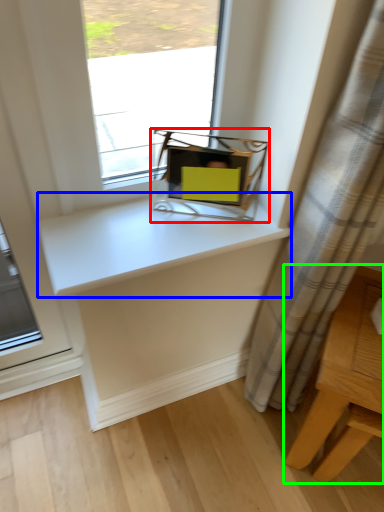
Question: Based on their relative distances, which object is nearer to equipment (highlighted by a red box)? Choose from counter top (highlighted by a blue box) and table (highlighted by a green box).

Choices:
 (A) counter top
 (B) table

Answer: (A)